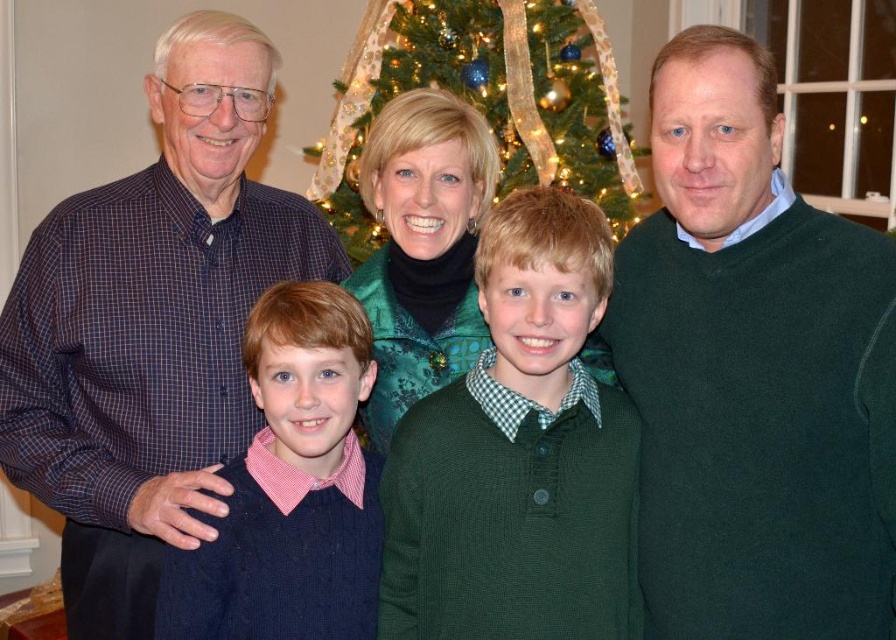
You are a photographer trying to capture a closeup of the green knitted sweater at center and the green fabric christmas tree at center. Which object should you zoom in on to ensure both fit in the frame without cropping?

You should zoom in on the green knitted sweater at center because it occupies less space than the green fabric christmas tree at center, allowing both to fit within the frame when focusing on the smaller object.